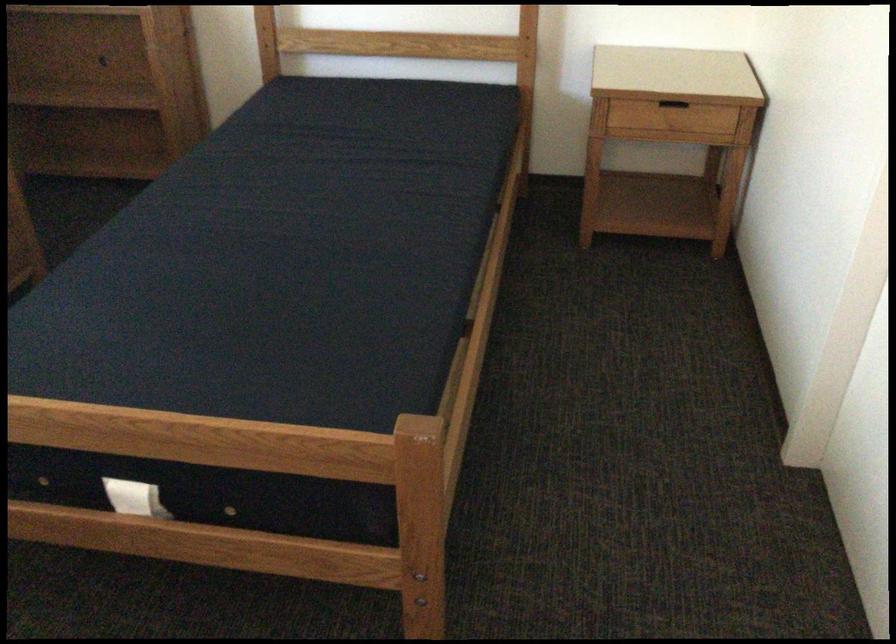
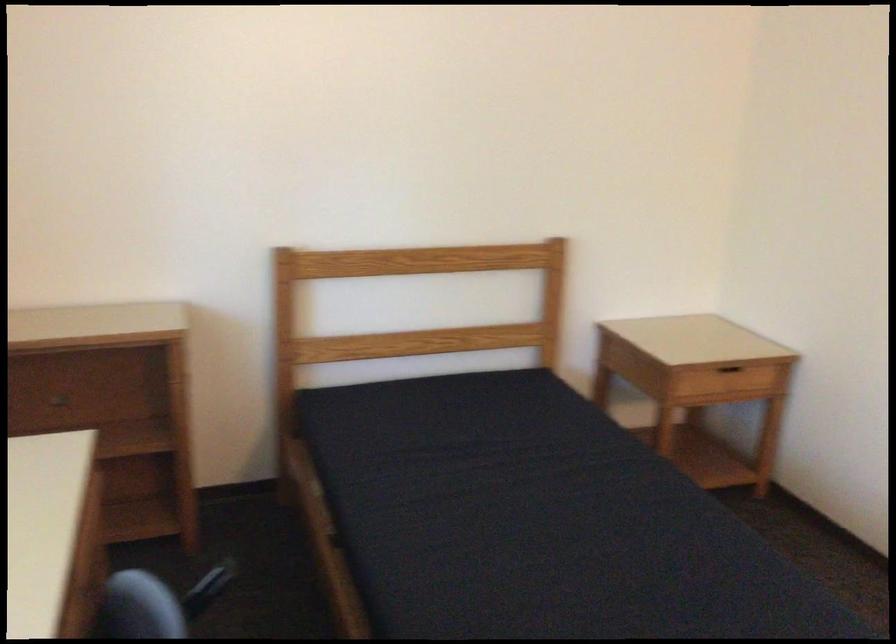
Find the pixel in the second image that matches point (647, 100) in the first image.

(727, 368)